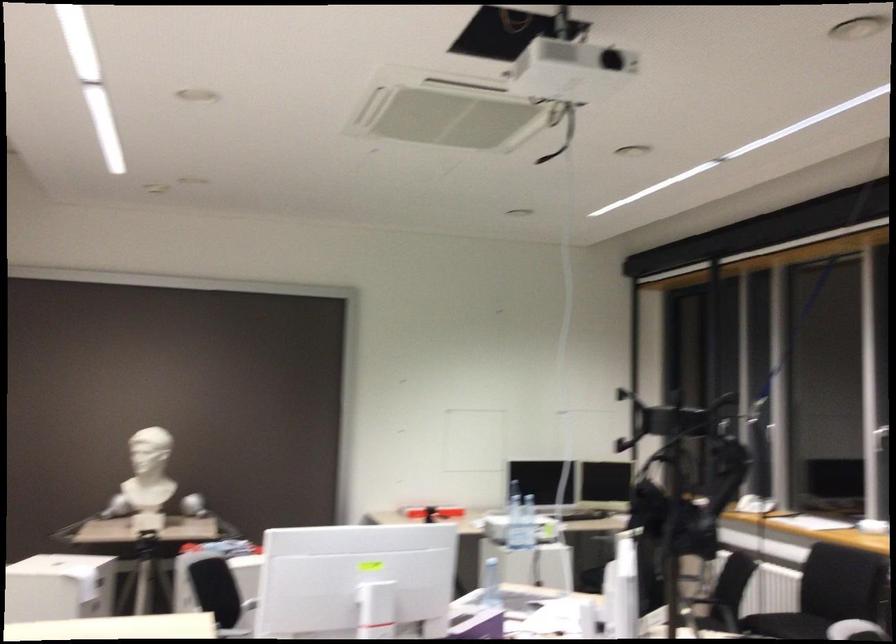
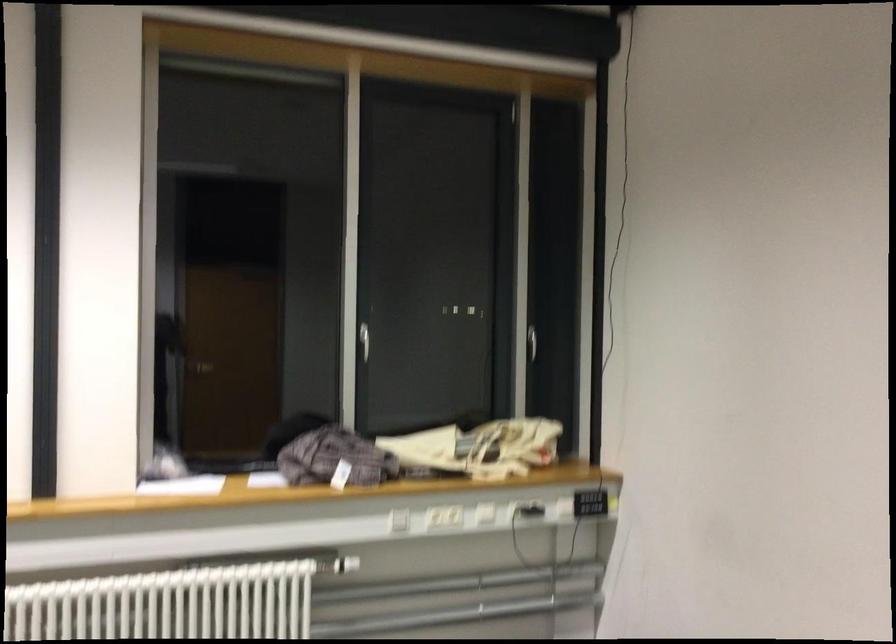
Question: Based on the continuous images, in which direction is the camera rotating? Reply with the corresponding letter.

Choices:
 (A) Left
 (B) Right
 (C) Up
 (D) Down

Answer: (B)